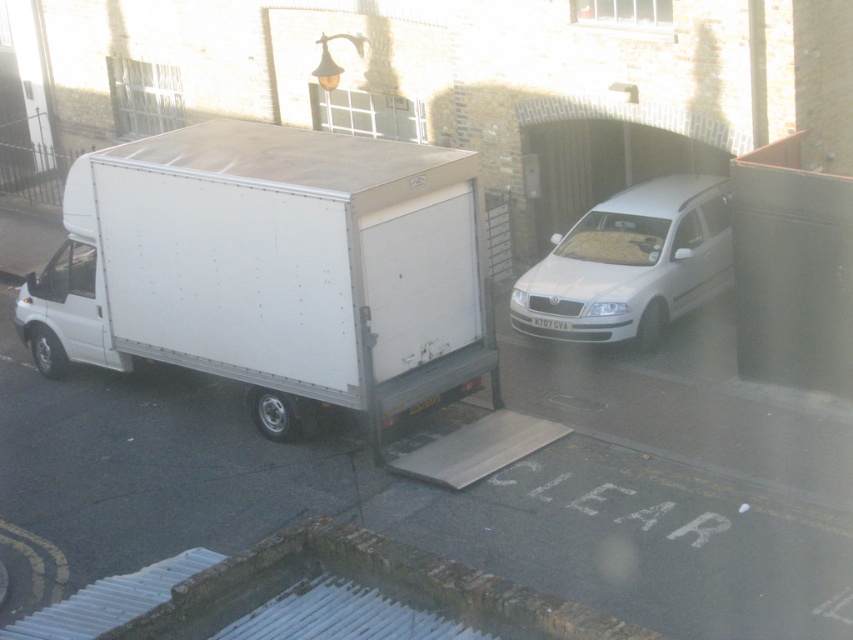
You are standing at the center of the street and want to locate the white matte truck at left. According to the coordinates given, in which direction should you look to find it?

You should look to the left since the white matte truck at left is located at point [273,268] which is on the left side of the image.

You are a delivery person who needs to back up your white matte truck at left to attach a trailer. The white plastic license plate at center is an obstacle. Can you safely back up without hitting the license plate if your truck requires 3 meters of clearance?

The distance between the white matte truck at left and the white plastic license plate at center is 3.04 meters. Since the truck needs 3 meters of clearance, there is enough space to safely back up without hitting the license plate.